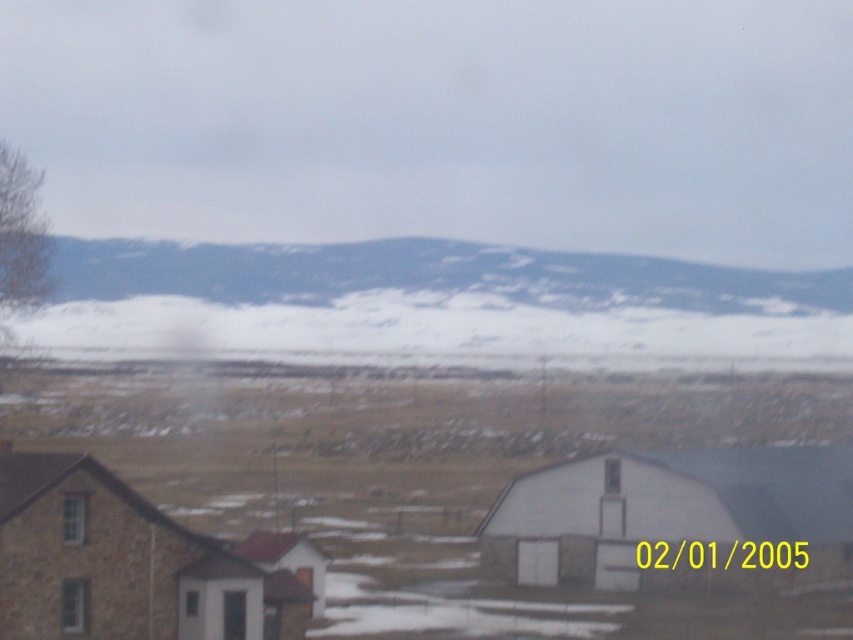
Question: Is the position of white matte barn at center more distant than that of snowy mountain at upper center?

Choices:
 (A) yes
 (B) no

Answer: (B)

Question: Does white matte barn at center appear over snowy mountain at upper center?

Choices:
 (A) yes
 (B) no

Answer: (B)

Question: Which is nearer to the white matte barn at center?

Choices:
 (A) snowy mountain at upper center
 (B) brown stone barn at lower left

Answer: (B)

Question: Which point is farther to the camera?

Choices:
 (A) (625, 525)
 (B) (610, 285)

Answer: (B)

Question: Which object appears farthest from the camera in this image?

Choices:
 (A) snowy mountain at upper center
 (B) white matte barn at center

Answer: (A)

Question: Does white matte barn at center have a smaller size compared to brown stone barn at lower left?

Choices:
 (A) no
 (B) yes

Answer: (A)